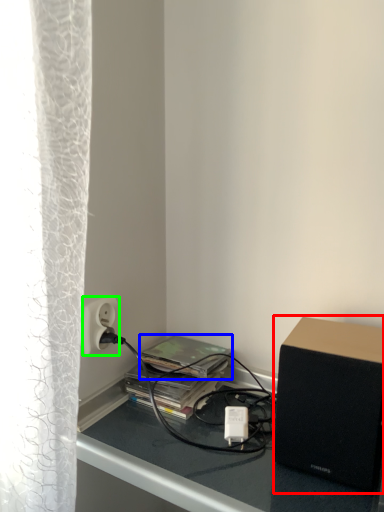
Question: Based on their relative distances, which object is farther from loudspeaker (highlighted by a red box)? Choose from paperback book (highlighted by a blue box) and power outlet (highlighted by a green box).

Choices:
 (A) paperback book
 (B) power outlet

Answer: (B)